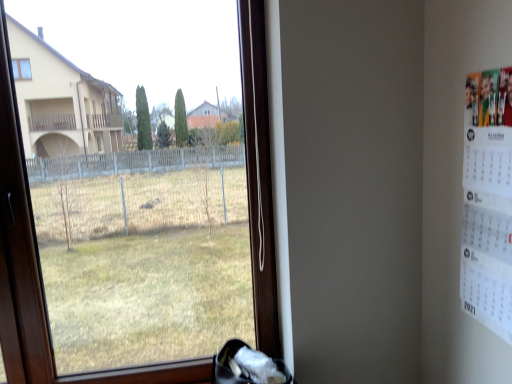
Question: Can you confirm if white fabric shoe at lower center is shorter than white paper calendar at right?

Choices:
 (A) yes
 (B) no

Answer: (A)

Question: Considering the relative sizes of white fabric shoe at lower center and white paper calendar at right in the image provided, is white fabric shoe at lower center bigger than white paper calendar at right?

Choices:
 (A) no
 (B) yes

Answer: (B)

Question: Can you confirm if white fabric shoe at lower center is thinner than white paper calendar at right?

Choices:
 (A) no
 (B) yes

Answer: (A)

Question: Could you tell me if white fabric shoe at lower center is facing white paper calendar at right?

Choices:
 (A) no
 (B) yes

Answer: (A)

Question: From the image's perspective, does white fabric shoe at lower center appear higher than white paper calendar at right?

Choices:
 (A) no
 (B) yes

Answer: (A)

Question: Is transparent glass window at center in front of or behind white fabric shoe at lower center in the image?

Choices:
 (A) behind
 (B) front

Answer: (B)

Question: Considering the positions of transparent glass window at center and white fabric shoe at lower center in the image, is transparent glass window at center bigger or smaller than white fabric shoe at lower center?

Choices:
 (A) small
 (B) big

Answer: (B)

Question: Is point tap(62, 349) positioned closer to the camera than point tap(232, 349)?

Choices:
 (A) farther
 (B) closer

Answer: (A)

Question: Looking at their shapes, would you say transparent glass window at center is wider or thinner than white fabric shoe at lower center?

Choices:
 (A) wide
 (B) thin

Answer: (B)

Question: Is point (218, 375) positioned closer to the camera than point (95, 157)?

Choices:
 (A) farther
 (B) closer

Answer: (B)

Question: From a real-world perspective, is white fabric shoe at lower center positioned above or below transparent glass window at center?

Choices:
 (A) below
 (B) above

Answer: (A)

Question: From their relative heights in the image, would you say white fabric shoe at lower center is taller or shorter than transparent glass window at center?

Choices:
 (A) short
 (B) tall

Answer: (A)

Question: Based on their sizes in the image, would you say white fabric shoe at lower center is bigger or smaller than transparent glass window at center?

Choices:
 (A) big
 (B) small

Answer: (B)

Question: In terms of size, does transparent glass window at center appear bigger or smaller than white paper calendar at right?

Choices:
 (A) big
 (B) small

Answer: (A)

Question: Considering the positions of transparent glass window at center and white paper calendar at right in the image, is transparent glass window at center wider or thinner than white paper calendar at right?

Choices:
 (A) wide
 (B) thin

Answer: (A)